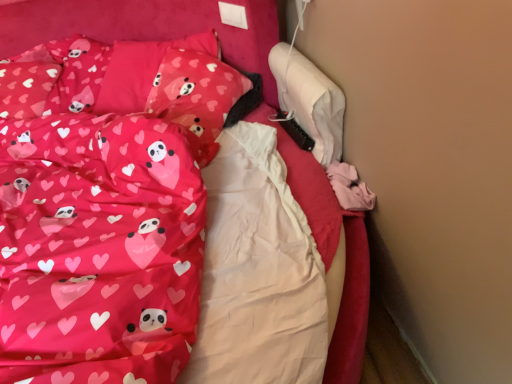
What do you see at coordinates (147, 27) in the screenshot?
I see `matte pink fabric bed at center` at bounding box center [147, 27].

The height and width of the screenshot is (384, 512). In order to click on matte pink pillow with heart and panda design at upper left, arranged as the second pillow when viewed from the back in this screenshot , I will do `click(196, 97)`.

Where is `matte pink fabric at left`? The width and height of the screenshot is (512, 384). matte pink fabric at left is located at coordinates (98, 249).

Image resolution: width=512 pixels, height=384 pixels. What are the coordinates of `matte pink fabric bed at center` in the screenshot? It's located at (147, 27).

Considering the relative sizes of matte pink pillow at upper left, marked as the second pillow in a front-to-back arrangement, and matte pink pillow with heart and panda design at upper left, which is the first pillow in front-to-back order, in the image provided, is matte pink pillow at upper left, marked as the second pillow in a front-to-back arrangement, bigger than matte pink pillow with heart and panda design at upper left, which is the first pillow in front-to-back order,?

Yes.

Considering the relative sizes of matte pink pillow at upper left, the 1th pillow in the back-to-front sequence, and matte pink pillow with heart and panda design at upper left, arranged as the second pillow when viewed from the back, in the image provided, is matte pink pillow at upper left, the 1th pillow in the back-to-front sequence, shorter than matte pink pillow with heart and panda design at upper left, arranged as the second pillow when viewed from the back,?

In fact, matte pink pillow at upper left, the 1th pillow in the back-to-front sequence, may be taller than matte pink pillow with heart and panda design at upper left, arranged as the second pillow when viewed from the back.

Which is further, (x=98, y=104) or (x=203, y=144)?

The point (x=98, y=104) is farther.

Is matte pink pillow at upper left, marked as the second pillow in a front-to-back arrangement, wider than matte pink pillow with heart and panda design at upper left, which is the first pillow in front-to-back order?

Correct, the width of matte pink pillow at upper left, marked as the second pillow in a front-to-back arrangement, exceeds that of matte pink pillow with heart and panda design at upper left, which is the first pillow in front-to-back order.

Considering the relative sizes of matte pink fabric at left and matte pink fabric bed at center in the image provided, is matte pink fabric at left taller than matte pink fabric bed at center?

Yes, matte pink fabric at left is taller than matte pink fabric bed at center.

Is matte pink fabric bed at center inside matte pink fabric at left?

No, matte pink fabric bed at center is not inside matte pink fabric at left.

Is matte pink fabric at left beside matte pink fabric bed at center?

They are not placed beside each other.

Considering the relative positions of matte pink fabric at left and matte pink fabric bed at center in the image provided, is matte pink fabric at left to the left or to the right of matte pink fabric bed at center?

Clearly, matte pink fabric at left is on the left of matte pink fabric bed at center in the image.

Based on the photo, considering the sizes of objects matte pink pillow at upper left, the 1th pillow in the back-to-front sequence, and matte pink fabric at left in the image provided, who is thinner, matte pink pillow at upper left, the 1th pillow in the back-to-front sequence, or matte pink fabric at left?

With smaller width is matte pink pillow at upper left, the 1th pillow in the back-to-front sequence.

From the picture: How far apart are matte pink pillow at upper left, marked as the second pillow in a front-to-back arrangement, and matte pink fabric at left?

matte pink pillow at upper left, marked as the second pillow in a front-to-back arrangement, and matte pink fabric at left are 61.28 centimeters apart.

From a real-world perspective, is matte pink pillow at upper left, marked as the second pillow in a front-to-back arrangement, below matte pink fabric at left?

Yes, from a real-world perspective, matte pink pillow at upper left, marked as the second pillow in a front-to-back arrangement, is under matte pink fabric at left.

Is matte pink pillow at upper left, the 1th pillow in the back-to-front sequence, behind matte pink fabric at left?

Yes, matte pink pillow at upper left, the 1th pillow in the back-to-front sequence, is further from the camera.

Who is smaller, matte pink fabric at left or matte pink pillow with heart and panda design at upper left, which is the first pillow in front-to-back order?

matte pink pillow with heart and panda design at upper left, which is the first pillow in front-to-back order.

From the image's perspective, relative to matte pink pillow with heart and panda design at upper left, which is the first pillow in front-to-back order, is matte pink fabric at left above or below?

matte pink fabric at left is below matte pink pillow with heart and panda design at upper left, which is the first pillow in front-to-back order.

Considering the relative positions of matte pink fabric at left and matte pink pillow with heart and panda design at upper left, arranged as the second pillow when viewed from the back, in the image provided, is matte pink fabric at left to the left or to the right of matte pink pillow with heart and panda design at upper left, arranged as the second pillow when viewed from the back,?

Based on their positions, matte pink fabric at left is located to the left of matte pink pillow with heart and panda design at upper left, arranged as the second pillow when viewed from the back.

Can you confirm if matte pink pillow with heart and panda design at upper left, arranged as the second pillow when viewed from the back, is shorter than matte pink fabric at left?

Indeed, matte pink pillow with heart and panda design at upper left, arranged as the second pillow when viewed from the back, has a lesser height compared to matte pink fabric at left.

The height and width of the screenshot is (384, 512). I want to click on the 2nd pillow counting from the right side of the matte pink fabric at left, so click(x=196, y=97).

Visually, is matte pink pillow with heart and panda design at upper left, arranged as the second pillow when viewed from the back, positioned to the left or to the right of matte pink fabric at left?

Clearly, matte pink pillow with heart and panda design at upper left, arranged as the second pillow when viewed from the back, is on the right of matte pink fabric at left in the image.

Based on the photo, who is bigger, matte pink pillow with heart and panda design at upper left, which is the first pillow in front-to-back order, or matte pink fabric at left?

With larger size is matte pink fabric at left.

Is matte pink pillow with heart and panda design at upper left, arranged as the second pillow when viewed from the back, not near matte pink pillow at upper left, the 1th pillow in the back-to-front sequence?

No, matte pink pillow with heart and panda design at upper left, arranged as the second pillow when viewed from the back, is not far from matte pink pillow at upper left, the 1th pillow in the back-to-front sequence.

Is matte pink pillow with heart and panda design at upper left, which is the first pillow in front-to-back order, aimed at matte pink pillow at upper left, marked as the second pillow in a front-to-back arrangement?

Yes, matte pink pillow with heart and panda design at upper left, which is the first pillow in front-to-back order, is turned towards matte pink pillow at upper left, marked as the second pillow in a front-to-back arrangement.

Is matte pink pillow with heart and panda design at upper left, arranged as the second pillow when viewed from the back, to the right of matte pink pillow at upper left, the 1th pillow in the back-to-front sequence, from the viewer's perspective?

Yes, matte pink pillow with heart and panda design at upper left, arranged as the second pillow when viewed from the back, is to the right of matte pink pillow at upper left, the 1th pillow in the back-to-front sequence.

Is matte pink fabric bed at center positioned far away from matte pink pillow with heart and panda design at upper left, which is the first pillow in front-to-back order?

No, matte pink fabric bed at center is not far from matte pink pillow with heart and panda design at upper left, which is the first pillow in front-to-back order.

Looking at this image, based on their sizes in the image, would you say matte pink fabric bed at center is bigger or smaller than matte pink pillow with heart and panda design at upper left, which is the first pillow in front-to-back order?

Clearly, matte pink fabric bed at center is larger in size than matte pink pillow with heart and panda design at upper left, which is the first pillow in front-to-back order.

Which of these two, matte pink fabric bed at center or matte pink pillow with heart and panda design at upper left, which is the first pillow in front-to-back order, is wider?

matte pink fabric bed at center is wider.

Find the location of a particular element. bed on the left of matte pink pillow with heart and panda design at upper left, which is the first pillow in front-to-back order is located at coordinates (147, 27).

This screenshot has height=384, width=512. Find the location of `pillow on the right of matte pink pillow at upper left, the 1th pillow in the back-to-front sequence`. pillow on the right of matte pink pillow at upper left, the 1th pillow in the back-to-front sequence is located at coordinates (196, 97).

The width and height of the screenshot is (512, 384). What are the coordinates of `blanket above the matte pink fabric bed at center (from the image's perspective)` in the screenshot? It's located at (98, 249).

Considering their positions, is matte pink pillow at upper left, marked as the second pillow in a front-to-back arrangement, positioned closer to matte pink fabric at left than matte pink fabric bed at center?

matte pink pillow at upper left, marked as the second pillow in a front-to-back arrangement, lies closer to matte pink fabric at left than the other object.

Estimate the real-world distances between objects in this image. Which object is closer to matte pink fabric bed at center, matte pink fabric at left or matte pink pillow with heart and panda design at upper left, arranged as the second pillow when viewed from the back?

matte pink pillow with heart and panda design at upper left, arranged as the second pillow when viewed from the back, is closer to matte pink fabric bed at center.

Considering their positions, is matte pink pillow with heart and panda design at upper left, arranged as the second pillow when viewed from the back, positioned further to matte pink pillow at upper left, marked as the second pillow in a front-to-back arrangement, than matte pink fabric bed at center?

matte pink fabric bed at center is positioned further to the anchor matte pink pillow at upper left, marked as the second pillow in a front-to-back arrangement.

Which object lies further to the anchor point matte pink fabric at left, matte pink fabric bed at center or matte pink pillow with heart and panda design at upper left, which is the first pillow in front-to-back order?

The object further to matte pink fabric at left is matte pink fabric bed at center.

From the image, which object appears to be nearer to matte pink pillow with heart and panda design at upper left, arranged as the second pillow when viewed from the back, matte pink fabric bed at center or matte pink fabric at left?

Among the two, matte pink fabric bed at center is located nearer to matte pink pillow with heart and panda design at upper left, arranged as the second pillow when viewed from the back.

Estimate the real-world distances between objects in this image. Which object is further from matte pink fabric bed at center, matte pink pillow at upper left, the 1th pillow in the back-to-front sequence, or matte pink pillow with heart and panda design at upper left, arranged as the second pillow when viewed from the back?

Among the two, matte pink pillow at upper left, the 1th pillow in the back-to-front sequence, is located further to matte pink fabric bed at center.

Looking at the image, which one is located further to matte pink fabric at left, matte pink pillow with heart and panda design at upper left, arranged as the second pillow when viewed from the back, or matte pink fabric bed at center?

Among the two, matte pink fabric bed at center is located further to matte pink fabric at left.

Which object lies further to the anchor point matte pink pillow at upper left, marked as the second pillow in a front-to-back arrangement, matte pink fabric bed at center or matte pink pillow with heart and panda design at upper left, arranged as the second pillow when viewed from the back?

Among the two, matte pink fabric bed at center is located further to matte pink pillow at upper left, marked as the second pillow in a front-to-back arrangement.

At what (x,y) coordinates should I click in order to perform the action: click on pillow between matte pink fabric at left and matte pink pillow at upper left, the 1th pillow in the back-to-front sequence, from front to back. Please return your answer as a coordinate pair (x, y). This screenshot has width=512, height=384. Looking at the image, I should click on (196, 97).

I want to click on bed positioned between matte pink fabric at left and matte pink pillow at upper left, the 1th pillow in the back-to-front sequence, from near to far, so click(147, 27).

The width and height of the screenshot is (512, 384). In order to click on bed positioned between matte pink fabric at left and matte pink pillow with heart and panda design at upper left, which is the first pillow in front-to-back order, from near to far in this screenshot , I will do `click(147, 27)`.

Locate an element on the screen. The width and height of the screenshot is (512, 384). pillow between matte pink fabric bed at center and matte pink pillow at upper left, marked as the second pillow in a front-to-back arrangement, along the z-axis is located at coordinates (196, 97).